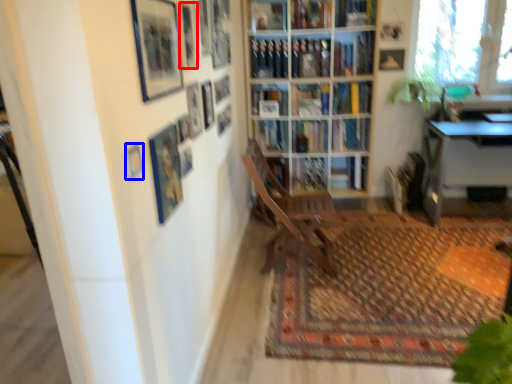
Question: Which object appears farthest to the camera in this image, picture frame (highlighted by a red box) or picture frame (highlighted by a blue box)?

Choices:
 (A) picture frame
 (B) picture frame

Answer: (A)